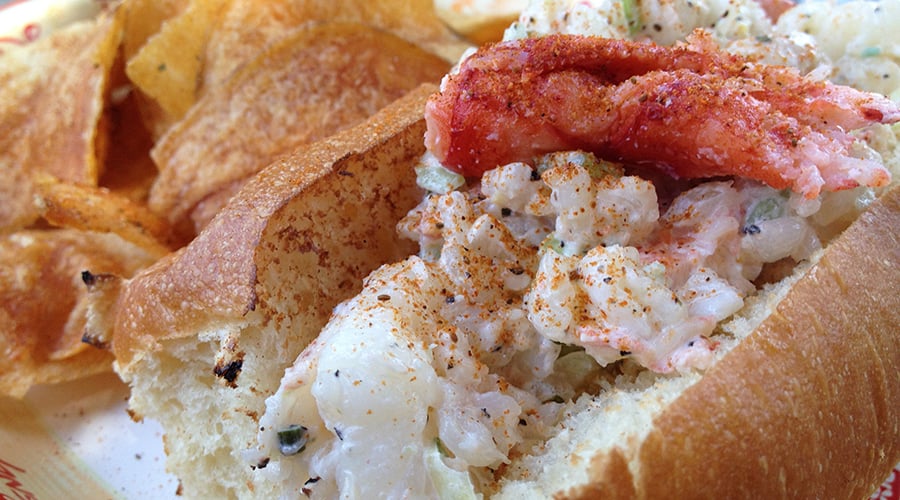
Where is `white and red placemat`? Image resolution: width=900 pixels, height=500 pixels. white and red placemat is located at coordinates (886, 492).